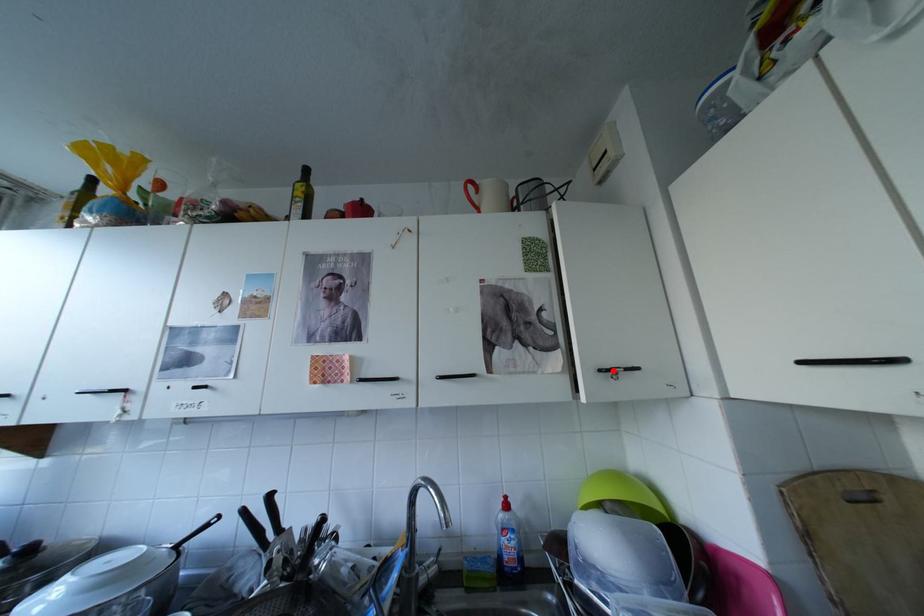
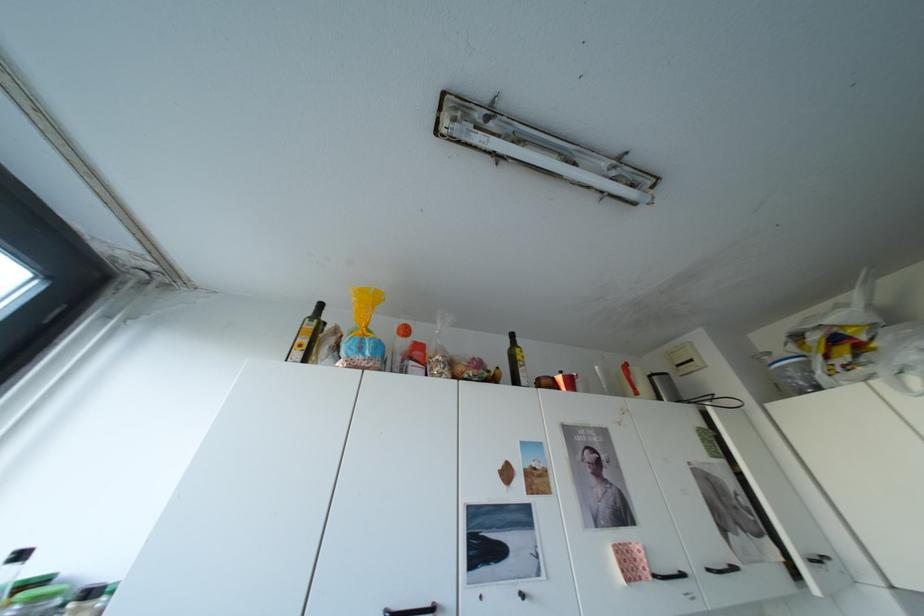
Question: I am providing you with two images of the same scene from different viewpoints. A red point is shown in image1. For the corresponding object point in image2, is it positioned nearer or farther from the camera?

Choices:
 (A) Nearer
 (B) Farther

Answer: (A)